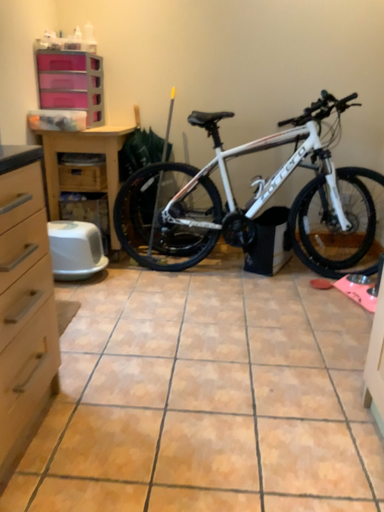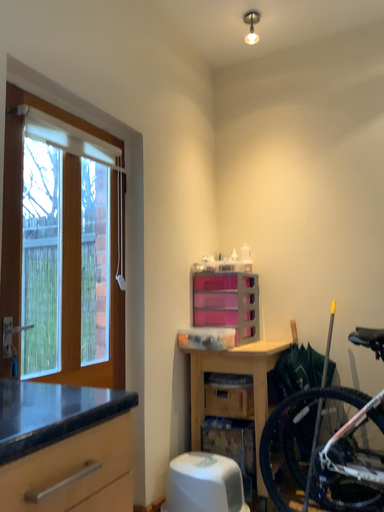
Question: Which way did the camera rotate in the video?

Choices:
 (A) rotated upward
 (B) rotated downward

Answer: (A)